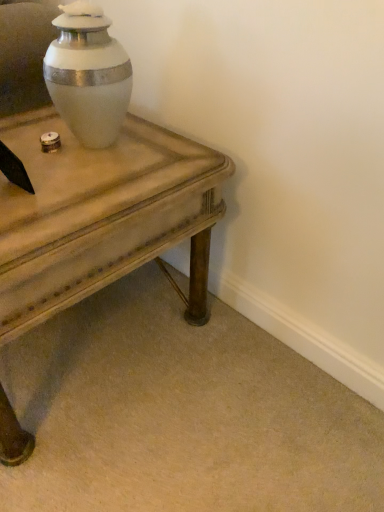
Find the location of a particular element. This screenshot has width=384, height=512. vacant space to the left of white glossy urn at upper center is located at coordinates (33, 130).